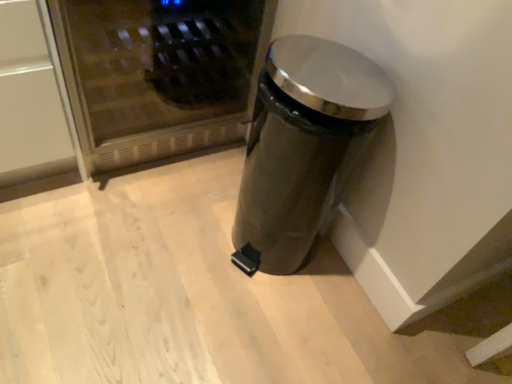
Question: Visually, is satin silver trash can at lower right positioned to the left or to the right of stainless steel microwave at upper left?

Choices:
 (A) right
 (B) left

Answer: (A)

Question: Considering the positions of satin silver trash can at lower right and stainless steel microwave at upper left in the image, is satin silver trash can at lower right wider or thinner than stainless steel microwave at upper left?

Choices:
 (A) thin
 (B) wide

Answer: (A)

Question: Is satin silver trash can at lower right in front of or behind stainless steel microwave at upper left in the image?

Choices:
 (A) behind
 (B) front

Answer: (B)

Question: Is stainless steel microwave at upper left situated inside satin silver trash can at lower right or outside?

Choices:
 (A) outside
 (B) inside

Answer: (A)

Question: Is stainless steel microwave at upper left to the left or to the right of satin silver trash can at lower right in the image?

Choices:
 (A) left
 (B) right

Answer: (A)

Question: Is stainless steel microwave at upper left taller or shorter than satin silver trash can at lower right?

Choices:
 (A) short
 (B) tall

Answer: (A)

Question: From a real-world perspective, is stainless steel microwave at upper left positioned above or below satin silver trash can at lower right?

Choices:
 (A) below
 (B) above

Answer: (A)